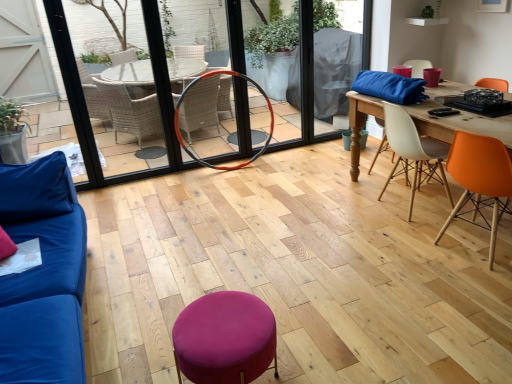
Locate an element on the screen. This screenshot has width=512, height=384. vacant area on top of purple fabric stool at center (from a real-world perspective) is located at coordinates (217, 320).